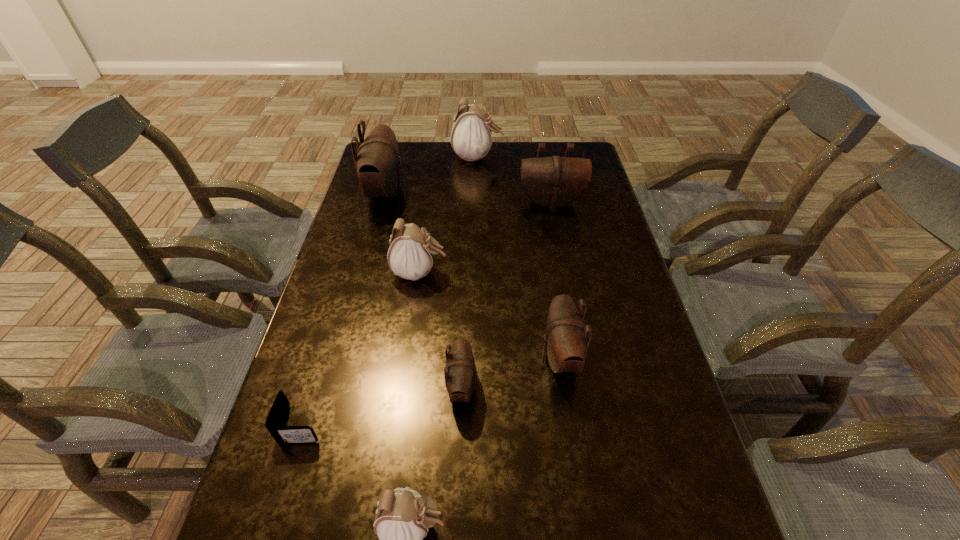
I want to click on vacant position located with the flap open on the leftmost brown pouch, so click(x=495, y=193).

At what (x,y) coordinates should I click in order to perform the action: click on free space located 0.280m on the front-facing side of the farthest object. Please return your answer as a coordinate pair (x, y). The height and width of the screenshot is (540, 960). Looking at the image, I should click on (574, 157).

What are the coordinates of `free region located 0.340m with the flap open on the second biggest brown pouch` in the screenshot? It's located at (567, 286).

This screenshot has height=540, width=960. I want to click on free space located 0.120m on the front-facing side of the second nearest white pouch, so click(x=490, y=273).

Locate an element on the screen. This screenshot has width=960, height=540. vacant space positioned 0.130m with the flap open on the second smallest brown pouch is located at coordinates (488, 357).

The image size is (960, 540). Identify the location of vacant space located with the flap open on the second smallest brown pouch. (467, 357).

At what (x,y) coordinates should I click in order to perform the action: click on vacant space located 0.170m with the flap open on the second smallest brown pouch. Please return your answer as a coordinate pair (x, y). The image size is (960, 540). Looking at the image, I should click on tap(470, 357).

Locate an element on the screen. The image size is (960, 540). vacant space located 0.180m with the flap open on the third brown pouch from right to left is located at coordinates (556, 388).

This screenshot has width=960, height=540. I want to click on vacant space located 0.360m on the outer surface of the wallet, so click(492, 424).

The height and width of the screenshot is (540, 960). What are the coordinates of `pouch positioned at the left edge` in the screenshot? It's located at (377, 161).